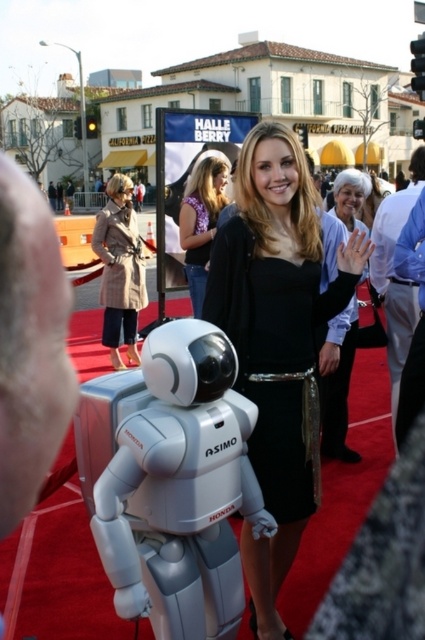
Does white matte robot at center appear on the right side of black satin dress at center?

No, white matte robot at center is not to the right of black satin dress at center.

The height and width of the screenshot is (640, 425). Identify the location of white matte robot at center. (181, 488).

Is point (189, 385) positioned after point (283, 164)?

No, it is not.

You are a GUI agent. You are given a task and a screenshot of the screen. Output one action in this format:
    pyautogui.click(x=<x>, y=<y>)
    Task: Click on the white matte robot at center
    Image resolution: width=425 pixels, height=640 pixels.
    Given the screenshot: What is the action you would take?
    pyautogui.click(x=181, y=488)

Is black satin dress at center positioned behind matte black dress at center?

That is True.

Does black satin dress at center have a smaller size compared to matte black dress at center?

No, black satin dress at center is not smaller than matte black dress at center.

Locate an element on the screen. Image resolution: width=425 pixels, height=640 pixels. black satin dress at center is located at coordinates (277, 340).

Is point (212, 483) more distant than point (115, 337)?

No, (212, 483) is in front of (115, 337).

Is white matte robot at center smaller than plaid wool coat at left?

Answer: Indeed, white matte robot at center has a smaller size compared to plaid wool coat at left.

Is point (172, 576) positioned behind point (98, 243)?

No, (172, 576) is in front of (98, 243).

Where is `white matte robot at center`? The width and height of the screenshot is (425, 640). white matte robot at center is located at coordinates tap(181, 488).